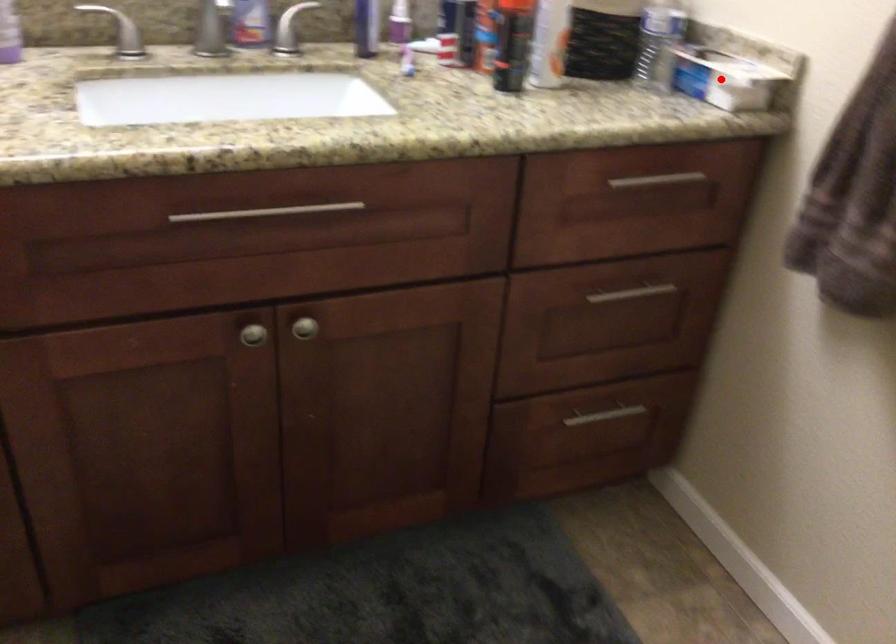
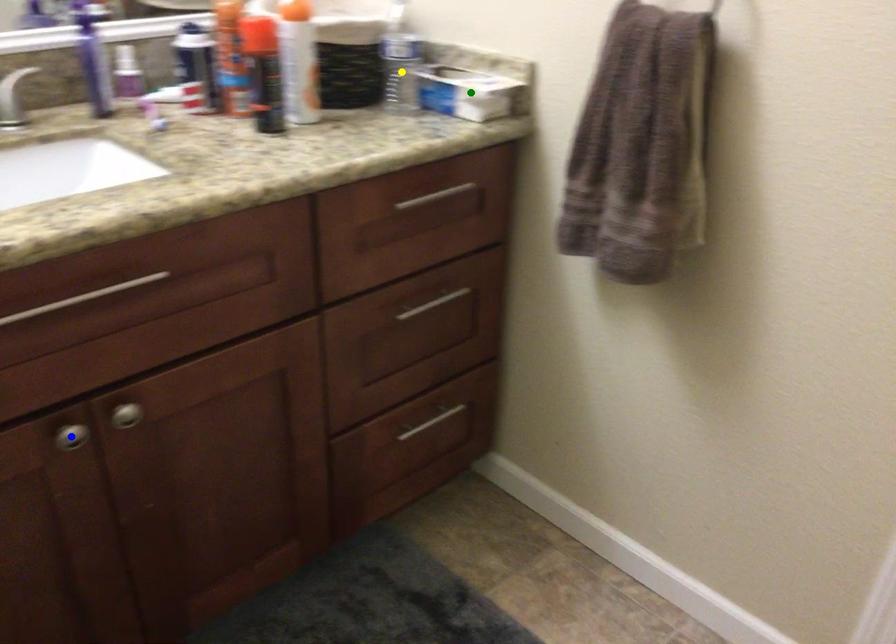
Question: I am providing you with two images of the same scene from different viewpoints. A red point is marked on the first image. You are given multiple points on the second image. In image 2, which mark is for the same physical point as the one in image 1?

Choices:
 (A) green point
 (B) yellow point
 (C) blue point

Answer: (A)